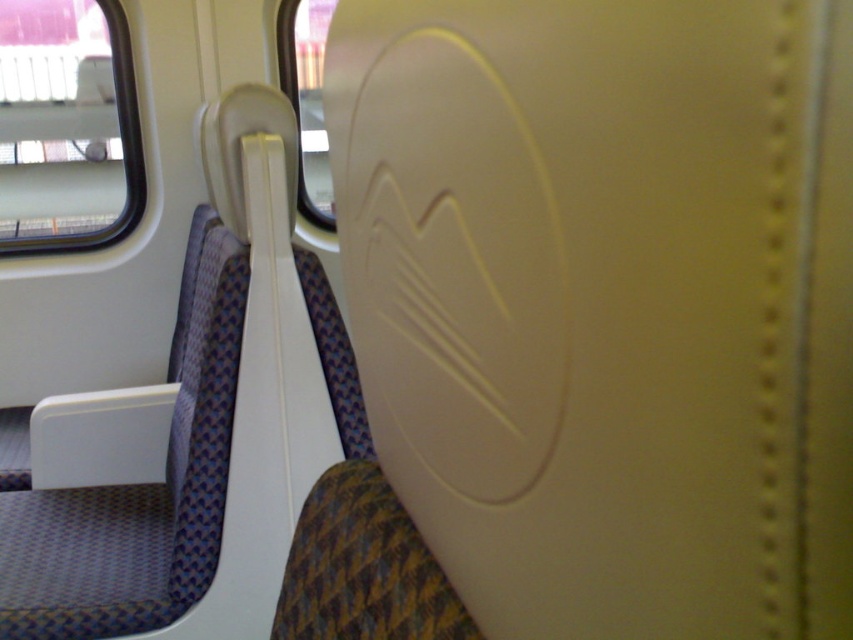
Question: Which point is closer to the camera?

Choices:
 (A) tap(320, 8)
 (B) tap(49, 51)

Answer: (A)

Question: Is transparent glass window at upper left bigger than transparent glass window at upper center?

Choices:
 (A) no
 (B) yes

Answer: (B)

Question: Does transparent glass window at upper left lie behind transparent glass window at upper center?

Choices:
 (A) no
 (B) yes

Answer: (B)

Question: Can you confirm if transparent glass window at upper left is positioned to the right of transparent glass window at upper center?

Choices:
 (A) yes
 (B) no

Answer: (B)

Question: Which point appears farthest from the camera in this image?

Choices:
 (A) (59, 113)
 (B) (317, 218)

Answer: (A)